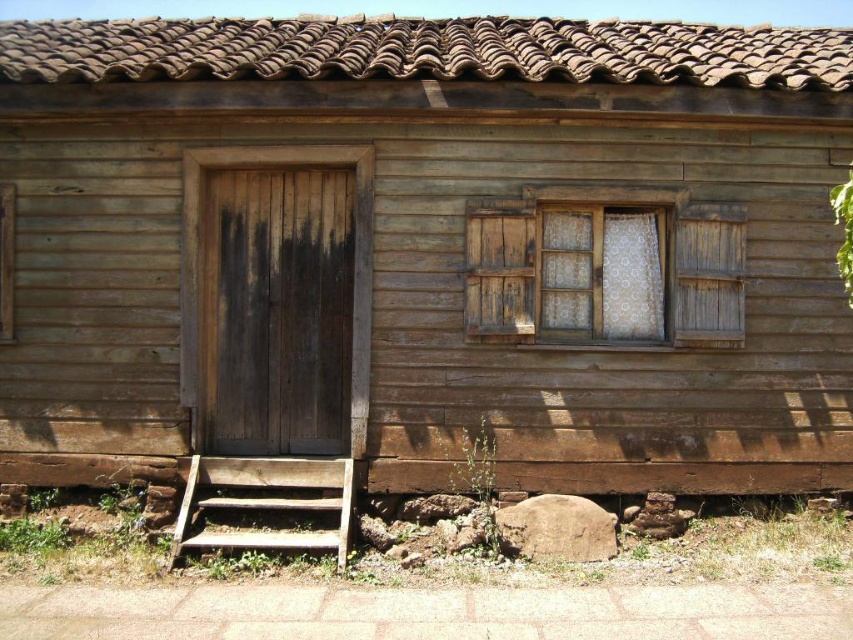
From the picture: You are standing in front of a rustic wooden house with a tiled roof. The house has a weathered appearance with horizontally slatted wood siding. There is a front door and a small window with wooden shutters to its right. A point at coordinates point (503, 262) marks the location of the weathered wood window at center. If you were to walk directly towards the house from this point, would you first encounter the front door or the weathered wood window at center?

The point at coordinates point (503, 262) marks the location of the weathered wood window at center. Since you are already at the point marking the window, you are already at the window and would not need to walk further to encounter it. However, the front door is located to the left of the window. Therefore, if you were to walk directly towards the house from this point, you would first encounter the weathered wood window at center before reaching the front door.

You are standing in front of a rustic wooden house with a weathered wood window at center. You want to take a photo of the window from a distance that is exactly 7 meters away. Is your current position suitable?

The distance between you and the weathered wood window at center is exactly 7.08 meters, which is very close to 7 meters. Therefore, your current position is suitable for taking the photo.

You are standing in front of the house and want to enter through the front door. You notice the weathered wood window at center and the weathered wood stairs at lower left. Which object is closer to the front door?

The weathered wood stairs at lower left are closer to the front door because the window is to the right of the stairs, meaning the stairs are positioned between the door and the window.